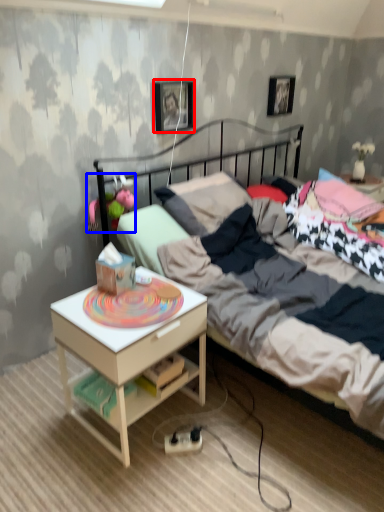
Question: Among these objects, which one is nearest to the camera, picture frame (highlighted by a red box) or toy (highlighted by a blue box)?

Choices:
 (A) picture frame
 (B) toy

Answer: (B)